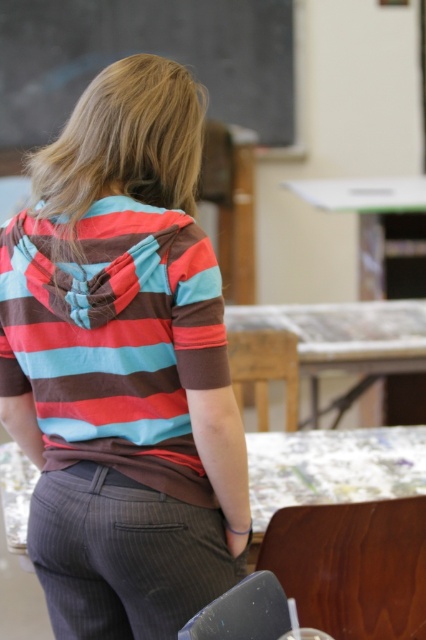
Which is below, striped cotton hoodie at center or green plastic table at upper center?

striped cotton hoodie at center

Is striped cotton hoodie at center taller than green plastic table at upper center?

Yes, striped cotton hoodie at center is taller than green plastic table at upper center.

Which is behind, point (120, 346) or point (317, 179)?

The point (317, 179) is more distant.

Find the location of `striped cotton hoodie at center`. striped cotton hoodie at center is located at coordinates (124, 369).

Does striped cotton hoodie at center have a lesser height compared to wooden table at center?

In fact, striped cotton hoodie at center may be taller than wooden table at center.

Find the location of a particular element. Image resolution: width=426 pixels, height=640 pixels. striped cotton hoodie at center is located at coordinates (124, 369).

Is striped cotton hoodie at center to the left of black chalkboard at upper center from the viewer's perspective?

Incorrect, striped cotton hoodie at center is not on the left side of black chalkboard at upper center.

Between point (58, 624) and point (249, 84), which one is positioned behind?

Point (249, 84)

In order to click on striped cotton hoodie at center in this screenshot , I will do `click(124, 369)`.